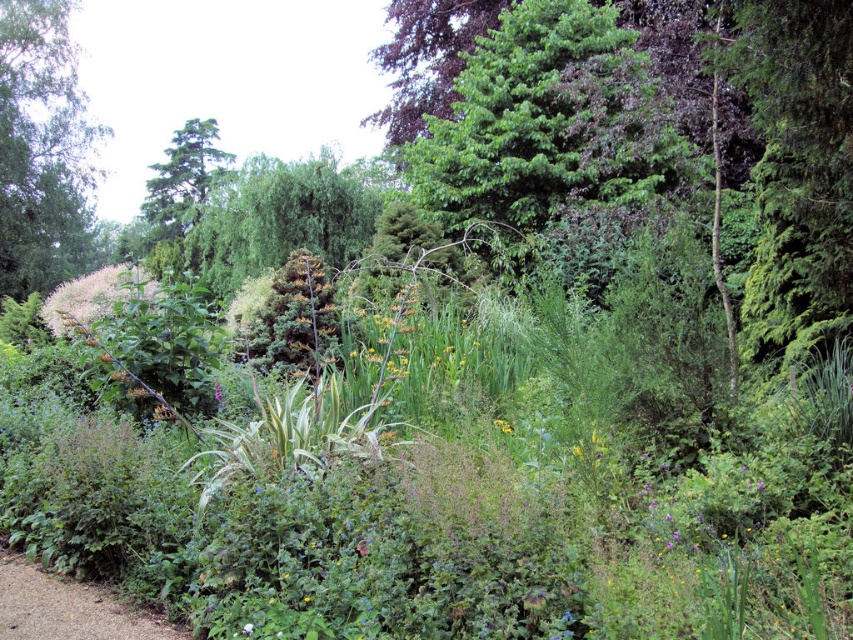
Question: Among these points, which one is nearest to the camera?

Choices:
 (A) (244, 625)
 (B) (20, 291)

Answer: (A)

Question: Is green leafy tree at upper left further to camera compared to gravel path at lower left?

Choices:
 (A) no
 (B) yes

Answer: (B)

Question: Can you confirm if green leafy tree at upper left is positioned to the right of gravel path at lower left?

Choices:
 (A) no
 (B) yes

Answer: (A)

Question: Which object appears farthest from the camera in this image?

Choices:
 (A) white fluffy flower at center
 (B) green leafy tree at upper left

Answer: (B)

Question: Which of the following is the closest to the observer?

Choices:
 (A) green leafy tree at upper left
 (B) white fluffy flower at center
 (C) gravel path at lower left

Answer: (B)

Question: Can you confirm if green leafy tree at upper left is positioned below white fluffy flower at center?

Choices:
 (A) yes
 (B) no

Answer: (B)